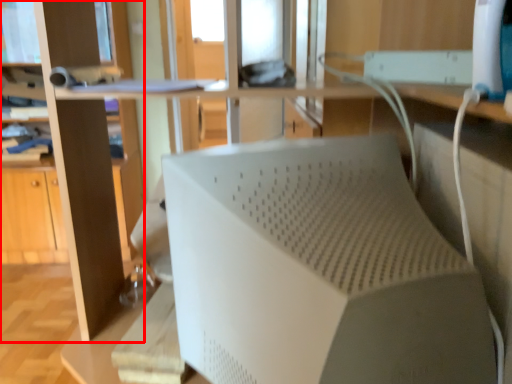
Question: From the image's perspective, what is the correct spatial positioning of bookshelf (annotated by the red box) in reference to wide?

Choices:
 (A) below
 (B) above

Answer: (B)